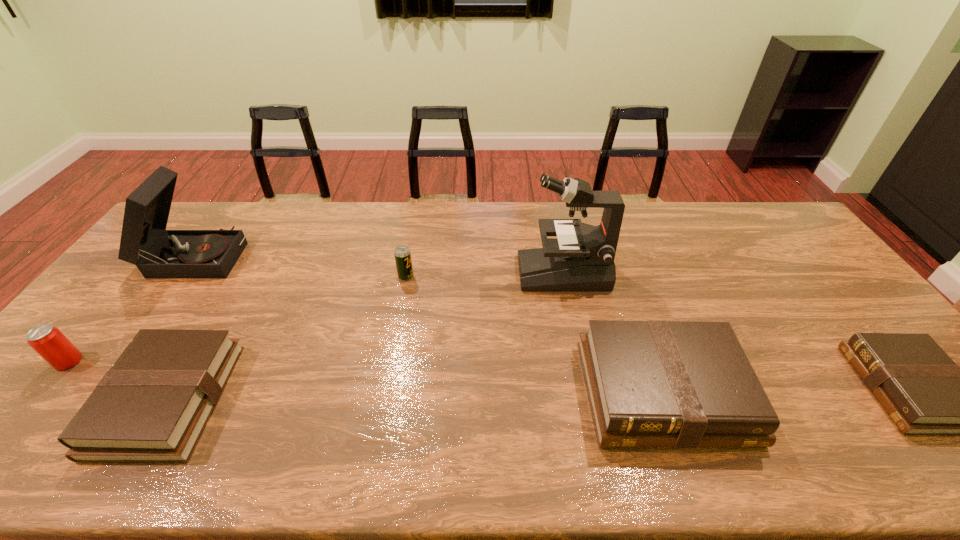
The width and height of the screenshot is (960, 540). In order to click on vacant space at the far edge of the desktop in this screenshot , I will do `click(319, 228)`.

You are a GUI agent. You are given a task and a screenshot of the screen. Output one action in this format:
    pyautogui.click(x=<x>, y=<y>)
    Task: Click on the vacant position at the near edge of the desktop
    The height and width of the screenshot is (540, 960).
    Given the screenshot: What is the action you would take?
    pyautogui.click(x=318, y=409)

This screenshot has width=960, height=540. Find the location of `vacant space at the left edge`. vacant space at the left edge is located at coordinates (34, 389).

At what (x,y) coordinates should I click in order to perform the action: click on blank space at the right edge. Please return your answer as a coordinate pair (x, y). Looking at the image, I should click on (837, 304).

Where is `free region at the near left corner of the desktop`? free region at the near left corner of the desktop is located at coordinates (84, 395).

Locate an element on the screen. vacant space at the far right corner of the desktop is located at coordinates [x=742, y=201].

Where is `unoccupied position between the can and the tallest Bible`? The image size is (960, 540). unoccupied position between the can and the tallest Bible is located at coordinates (366, 376).

This screenshot has width=960, height=540. In order to click on vacant region between the can and the tallest Bible in this screenshot , I will do `click(366, 376)`.

What are the coordinates of `vacant region between the tallest Bible and the phonograph_record` in the screenshot? It's located at (430, 323).

I want to click on free point between the microscope and the second tallest object, so click(x=379, y=264).